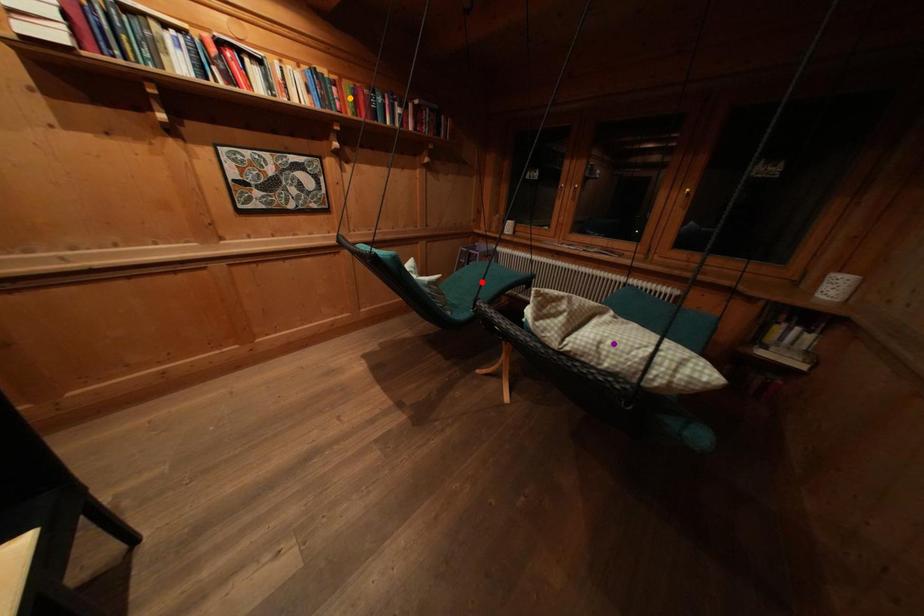
Order these from nearest to farthest:
purple point | red point | orange point

orange point, red point, purple point